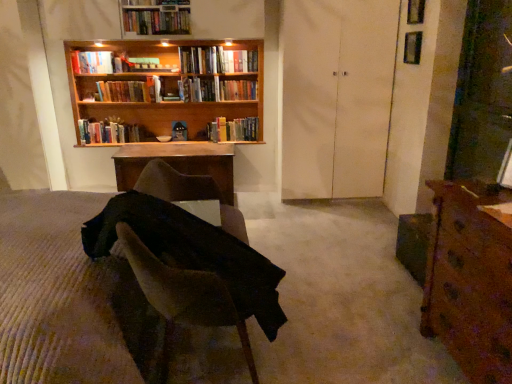
The height and width of the screenshot is (384, 512). I want to click on empty space that is ontop of hardcover books at upper left, which ranks as the sixth book in top-to-bottom order (from a real-world perspective), so click(119, 81).